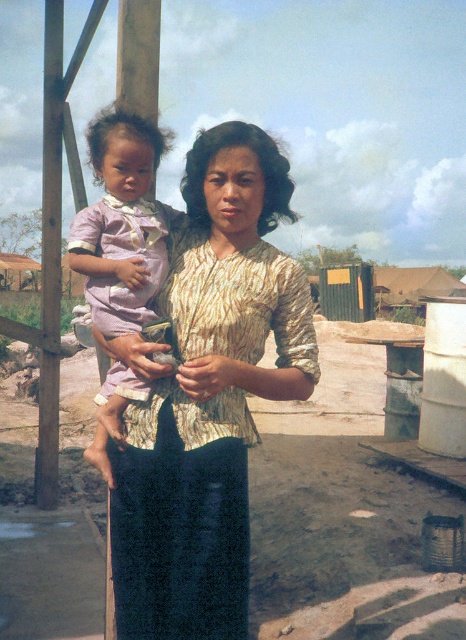
Question: Which of the following is the closest to the observer?

Choices:
 (A) pink satin dress at left
 (B) printed fabric blouse at center

Answer: (B)

Question: Does printed fabric blouse at center appear on the right side of pink satin dress at left?

Choices:
 (A) no
 (B) yes

Answer: (B)

Question: Can you confirm if printed fabric blouse at center is smaller than pink satin dress at left?

Choices:
 (A) yes
 (B) no

Answer: (B)

Question: Can you confirm if printed fabric blouse at center is positioned below pink satin dress at left?

Choices:
 (A) no
 (B) yes

Answer: (B)